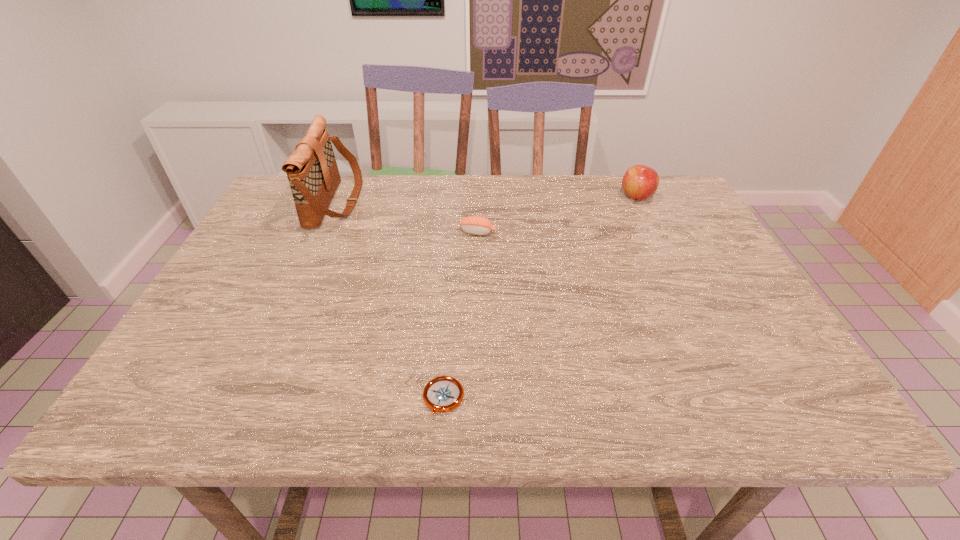
The width and height of the screenshot is (960, 540). Find the location of `the tallest object`. the tallest object is located at coordinates (312, 171).

Find the location of a particular element. The height and width of the screenshot is (540, 960). shoulder bag is located at coordinates (312, 171).

The image size is (960, 540). Identify the location of the rightmost object. (640, 182).

What are the coordinates of `apple` in the screenshot? It's located at (640, 182).

In order to click on the second shortest object in this screenshot , I will do `click(478, 225)`.

Where is `the nearest object`? Image resolution: width=960 pixels, height=540 pixels. the nearest object is located at coordinates (442, 394).

At what (x,y) coordinates should I click in order to perform the action: click on the shortest object. Please return your answer as a coordinate pair (x, y). Looking at the image, I should click on (442, 394).

I want to click on free space located on the front-facing side of the tallest object, so click(x=382, y=202).

The height and width of the screenshot is (540, 960). In order to click on blank space located 0.210m on the left of the third shortest object in this screenshot , I will do `click(548, 197)`.

Locate an element on the screen. vacant area situated on the back of the sushi is located at coordinates tap(478, 182).